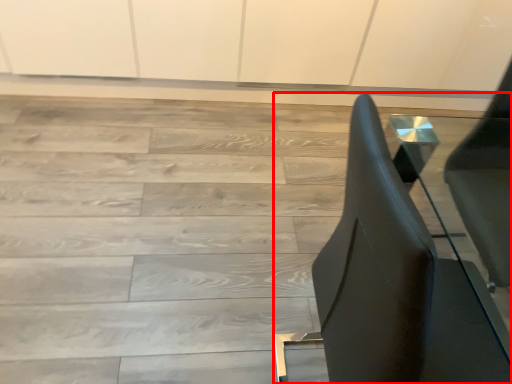
Question: From the image, what is the correct spatial relationship of furniture (annotated by the red box) in relation to stairwell?

Choices:
 (A) left
 (B) right

Answer: (B)